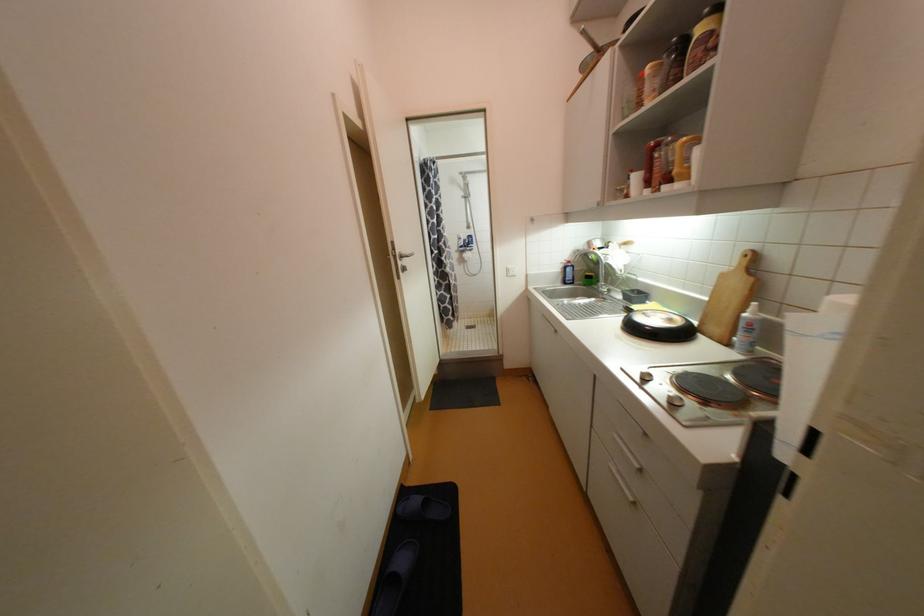
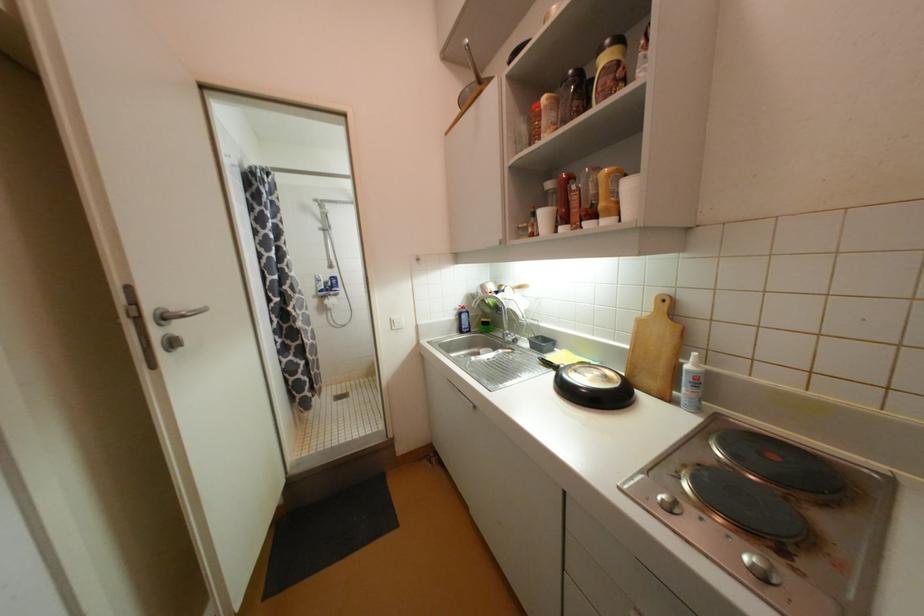
In the second image, find the point that corresponds to (750,315) in the first image.

(693, 368)